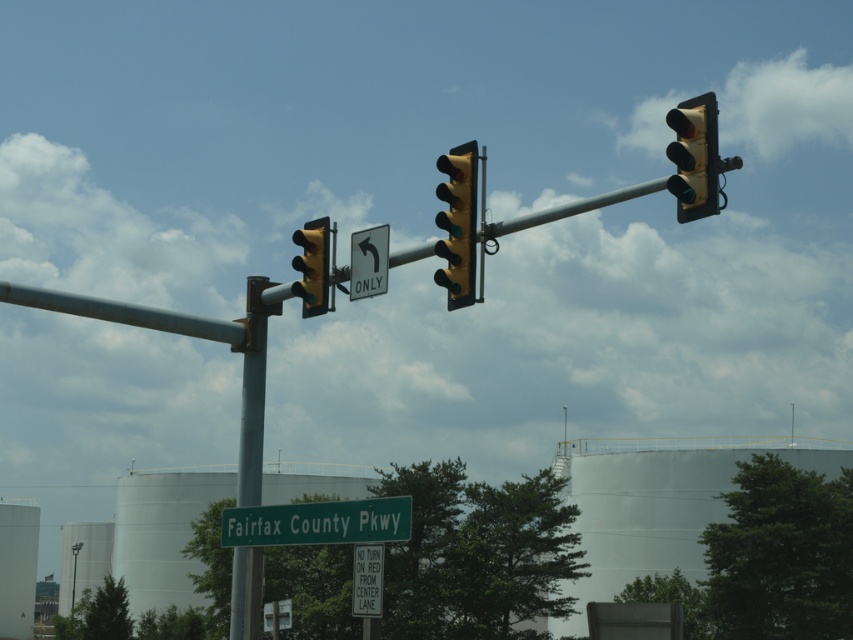
Question: Can you confirm if green metallic street sign at center is positioned to the left of yellow matte traffic light at center?

Choices:
 (A) yes
 (B) no

Answer: (A)

Question: Which point appears farthest from the camera in this image?

Choices:
 (A) (438, 280)
 (B) (373, 560)
 (C) (291, 262)

Answer: (C)

Question: Is metallic pole at center smaller than yellow matte traffic light at center?

Choices:
 (A) yes
 (B) no

Answer: (B)

Question: Is yellow matte traffic light at upper center thinner than metallic pole at upper center?

Choices:
 (A) no
 (B) yes

Answer: (B)

Question: Estimate the real-world distances between objects in this image. Which object is closer to the yellow matte traffic light at center?

Choices:
 (A) metallic pole at center
 (B) white paper sign at lower center
 (C) yellow matte traffic light at upper center

Answer: (C)

Question: Which point appears farthest from the camera in this image?

Choices:
 (A) (317, 285)
 (B) (698, 118)
 (C) (368, 548)

Answer: (A)